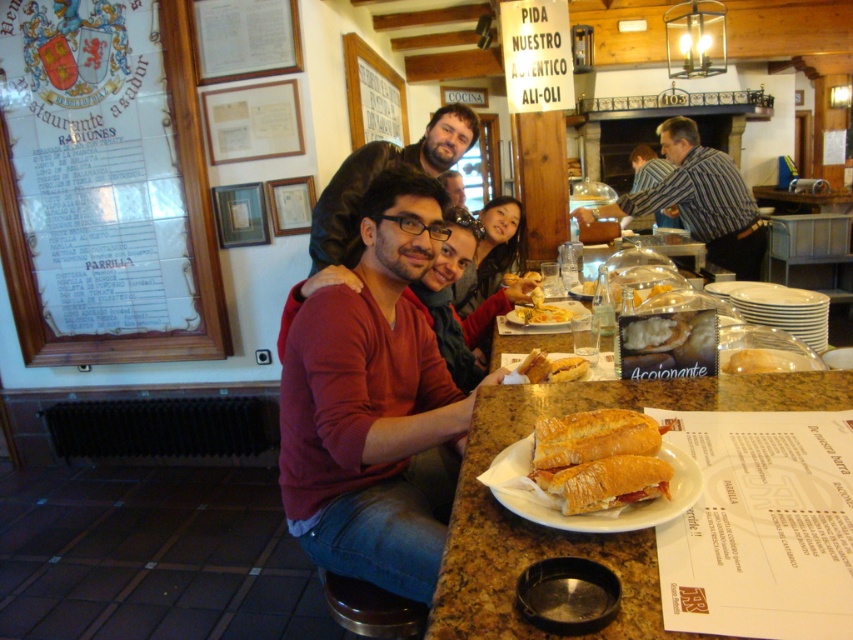
You are a food critic visiting this Spanish restaurant and notice two types of bread on the table. The golden brown bread at center and the slightly toasted bread at center. Which one is wider?

The golden brown bread at center is wider than the slightly toasted bread at center.

You are a photographer trying to capture a closeup of the slightly toasted bread at center without including the striped shirt at upper right in the frame. Is it possible to do so given their positions?

The striped shirt at upper right might be wider than slightly toasted bread at center, so there is a possibility that the striped shirt at upper right could block the view of the slightly toasted bread at center. To ensure the bread is captured without the shirt, adjust the camera angle to avoid the wider striped shirt at upper right.

Based on the photo, you are a waiter in a busy restaurant and need to quickly deliver a drink to the table. The table has a white paper plate at center and a brown bread at center. Which item should you place the drink closer to without disturbing the food?

The white paper plate at center and brown bread at center are 25.67 inches apart. To place the drink closer to the white paper plate at center without disturbing the food, ensure the drink is positioned near the plate since it is already at the center, maintaining a safe distance from the brown bread at center.